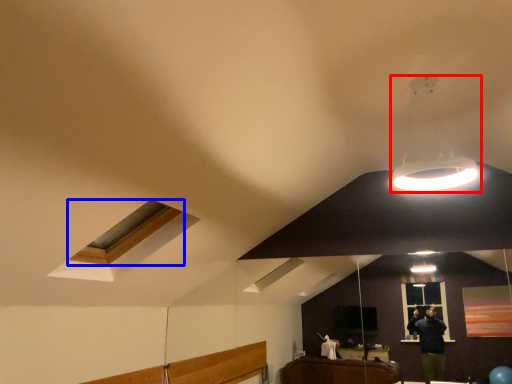
Question: Which object appears closest to the camera in this image, lamp (highlighted by a red box) or window (highlighted by a blue box)?

Choices:
 (A) lamp
 (B) window

Answer: (A)